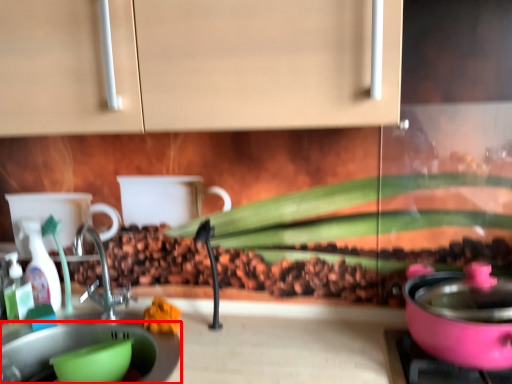
Question: In this image, where is sink (annotated by the red box) located relative to bottle?

Choices:
 (A) left
 (B) right

Answer: (B)